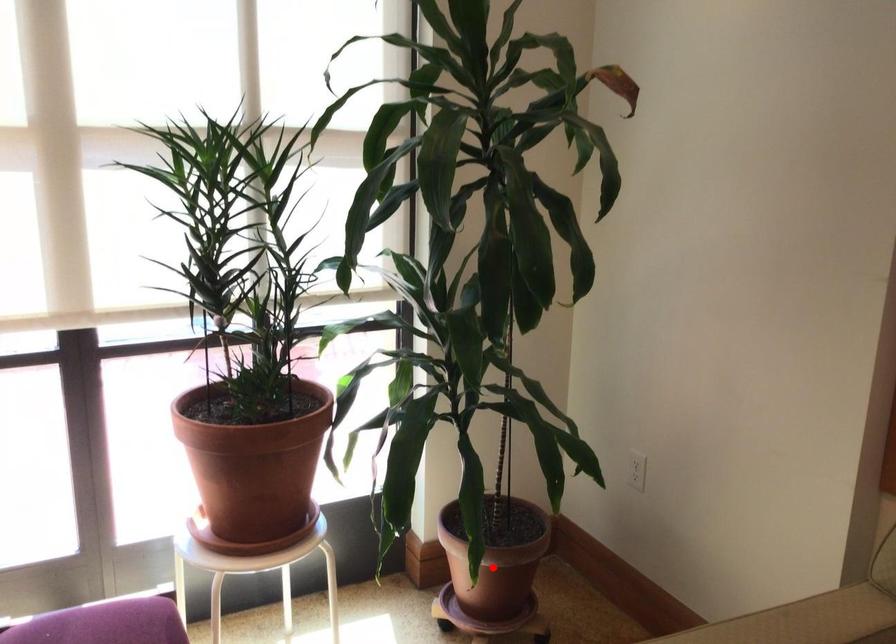
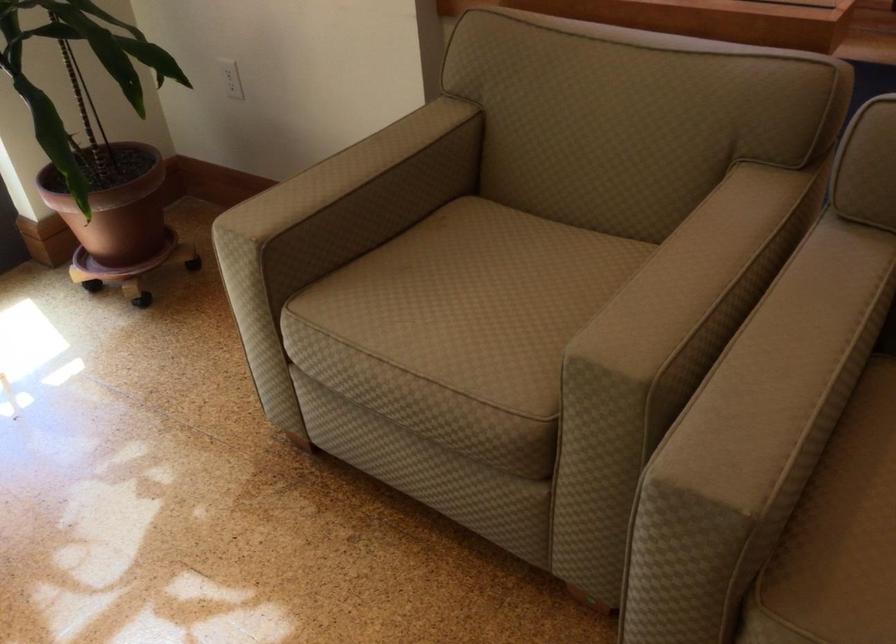
Find the pixel in the second image that matches the highlighted location in the first image.

(116, 210)